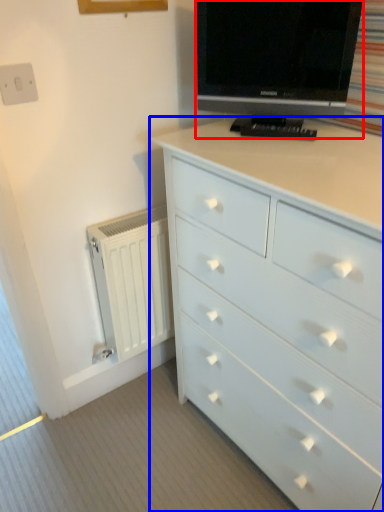
Question: Which of the following is the farthest to the observer, television (highlighted by a red box) or chest of drawers (highlighted by a blue box)?

Choices:
 (A) television
 (B) chest of drawers

Answer: (A)